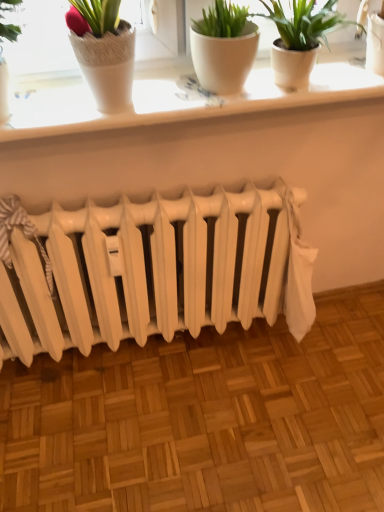
What do you see at coordinates (157, 271) in the screenshot? The image size is (384, 512). I see `white matte radiator at center` at bounding box center [157, 271].

Identify the location of white ceramic window sill at upper center. The image size is (384, 512). (181, 102).

I want to click on white matte flowerpot at upper center, so click(x=224, y=58).

Who is shorter, white ceramic window sill at upper center or white matte radiator at center?

white ceramic window sill at upper center is shorter.

Is white ceramic window sill at upper center directly adjacent to white matte radiator at center?

No, white ceramic window sill at upper center is not with white matte radiator at center.

Which object is wider, white ceramic window sill at upper center or white matte radiator at center?

white ceramic window sill at upper center.

Is point (141, 101) behind point (206, 234)?

No, (141, 101) is in front of (206, 234).

Is white ceramic window sill at upper center turned away from white matte flowerpot at upper center?

That's not correct — white ceramic window sill at upper center is not looking away from white matte flowerpot at upper center.

Consider the image. Is white ceramic window sill at upper center located outside white matte flowerpot at upper center?

white ceramic window sill at upper center lies outside white matte flowerpot at upper center's area.

Find the location of `window sill that is under the white matte flowerpot at upper center (from a real-world perspective)`. window sill that is under the white matte flowerpot at upper center (from a real-world perspective) is located at coordinates (181, 102).

Is point (99, 114) more distant than point (254, 54)?

No.

Is white matte radiator at center wider than white ceramic window sill at upper center?

No, white matte radiator at center is not wider than white ceramic window sill at upper center.

From the picture: Relative to white ceramic window sill at upper center, is white matte radiator at center in front or behind?

Visually, white matte radiator at center is located behind white ceramic window sill at upper center.

Is white matte radiator at center far from white ceramic window sill at upper center?

No, white matte radiator at center is in close proximity to white ceramic window sill at upper center.

How distant is white matte flowerpot at upper center from white ceramic window sill at upper center?

6.45 inches.

Can we say white matte flowerpot at upper center lies outside white ceramic window sill at upper center?

Indeed, white matte flowerpot at upper center is completely outside white ceramic window sill at upper center.

Can you confirm if white matte flowerpot at upper center is shorter than white ceramic window sill at upper center?

No, white matte flowerpot at upper center is not shorter than white ceramic window sill at upper center.

Which object is further away from the camera taking this photo, white matte flowerpot at upper center or white ceramic window sill at upper center?

white ceramic window sill at upper center is more distant.

From the image's perspective, is white matte flowerpot at upper center below white matte radiator at center?

No, from the image's perspective, white matte flowerpot at upper center is not below white matte radiator at center.

Looking at this image, is white matte flowerpot at upper center turned away from white matte radiator at center?

No, white matte flowerpot at upper center is not facing the opposite direction of white matte radiator at center.

Would you say white matte radiator at center is part of white matte flowerpot at upper center's contents?

That's incorrect, white matte radiator at center is not inside white matte flowerpot at upper center.

Is white matte radiator at center inside the boundaries of white matte flowerpot at upper center, or outside?

white matte radiator at center is located beyond the bounds of white matte flowerpot at upper center.

From a real-world perspective, who is located lower, white matte radiator at center or white matte flowerpot at upper center?

white matte radiator at center, from a real-world perspective.

Where is `flowerpot located above the white matte radiator at center (from the image's perspective)`? The height and width of the screenshot is (512, 384). flowerpot located above the white matte radiator at center (from the image's perspective) is located at coordinates (224, 58).

From the picture: Is white matte radiator at center with white matte flowerpot at upper center?

No, white matte radiator at center is not touching white matte flowerpot at upper center.

Locate an element on the screen. window sill lying in front of the white matte radiator at center is located at coordinates 181,102.

The width and height of the screenshot is (384, 512). I want to click on window sill behind the white matte flowerpot at upper center, so click(x=181, y=102).

From the image, which object appears to be nearer to white ceramic window sill at upper center, white matte radiator at center or white matte flowerpot at upper center?

white matte flowerpot at upper center.

Based on their spatial positions, is white ceramic window sill at upper center or white matte flowerpot at upper center further from white matte radiator at center?

white matte flowerpot at upper center is positioned further to the anchor white matte radiator at center.

Based on the photo, which object lies further to the anchor point white matte flowerpot at upper center, white matte radiator at center or white ceramic window sill at upper center?

The object further to white matte flowerpot at upper center is white matte radiator at center.

Estimate the real-world distances between objects in this image. Which object is further from white ceramic window sill at upper center, white matte flowerpot at upper center or white matte radiator at center?

The object further to white ceramic window sill at upper center is white matte radiator at center.

Considering their positions, is white ceramic window sill at upper center positioned further to white matte flowerpot at upper center than white matte radiator at center?

white matte radiator at center is further to white matte flowerpot at upper center.

From the image, which object appears to be farther from white matte radiator at center, white matte flowerpot at upper center or white ceramic window sill at upper center?

Among the two, white matte flowerpot at upper center is located further to white matte radiator at center.

This screenshot has height=512, width=384. Identify the location of window sill that lies between white matte flowerpot at upper center and white matte radiator at center from top to bottom. (181, 102).